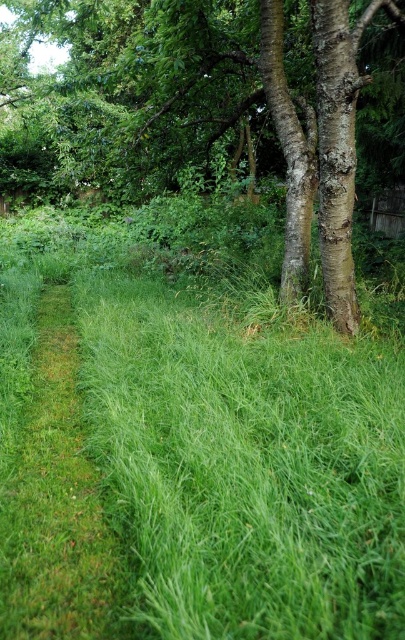
Question: Among these points, which one is farthest from the camera?

Choices:
 (A) pos(236,420)
 (B) pos(390,154)

Answer: (B)

Question: Is green grassy at center behind smooth bark tree at center?

Choices:
 (A) yes
 (B) no

Answer: (B)

Question: Is green grassy at center further to the viewer compared to smooth bark tree at center?

Choices:
 (A) yes
 (B) no

Answer: (B)

Question: Can you confirm if green grassy at center is positioned above smooth bark tree at center?

Choices:
 (A) no
 (B) yes

Answer: (A)

Question: Which point is farther from the camera taking this photo?

Choices:
 (A) click(x=85, y=48)
 (B) click(x=232, y=435)

Answer: (A)

Question: Which of the following is the farthest from the observer?

Choices:
 (A) (25, 545)
 (B) (36, 180)

Answer: (B)